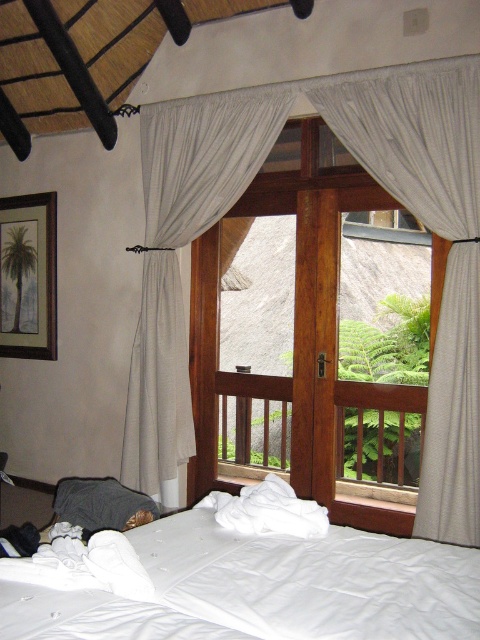
Can you confirm if wooden door at center is positioned below white textured curtain at center?

Indeed, wooden door at center is positioned under white textured curtain at center.

At what (x,y) coordinates should I click in order to perform the action: click on wooden door at center. Please return your answer as a coordinate pair (x, y). The image size is (480, 640). Looking at the image, I should click on (320, 332).

How much distance is there between white soft bed at lower left and white sheer curtain at center?

white soft bed at lower left and white sheer curtain at center are 1.95 meters apart from each other.

Which is above, white soft bed at lower left or white sheer curtain at center?

white sheer curtain at center

Between point (319, 637) and point (242, 161), which one is positioned in front?

Point (319, 637) is in front.

Locate an element on the screen. white soft bed at lower left is located at coordinates (240, 586).

Who is shorter, white textured curtain at center or white sheer curtain at center?

white textured curtain at center is shorter.

Who is lower down, white textured curtain at center or white sheer curtain at center?

white textured curtain at center is lower down.

Between point (476, 451) and point (178, 241), which one is positioned behind?

Positioned behind is point (178, 241).

The image size is (480, 640). What are the coordinates of `white textured curtain at center` in the screenshot? It's located at (447, 253).